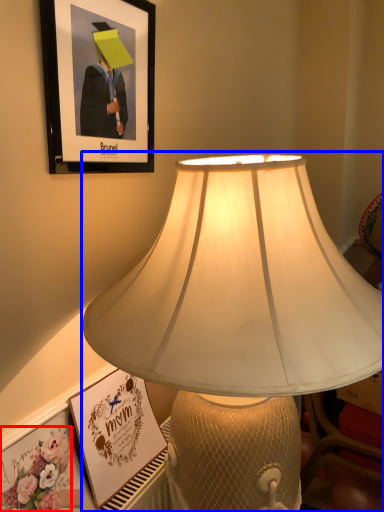
Question: Which object appears closest to the camera in this image, flower (highlighted by a red box) or lamp (highlighted by a blue box)?

Choices:
 (A) flower
 (B) lamp

Answer: (B)